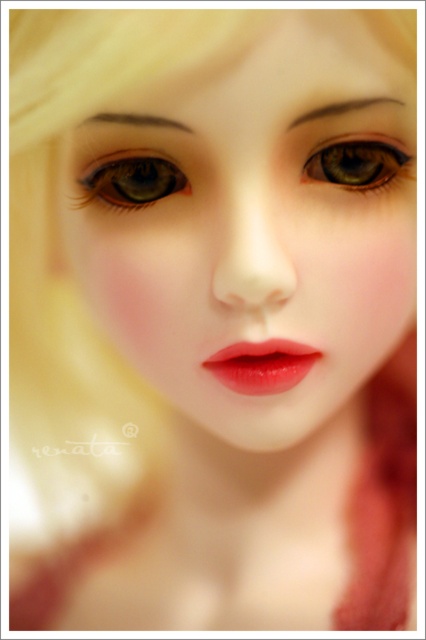
Question: Which point is farther to the camera?

Choices:
 (A) glossy matte lips at center
 (B) matte green eye at center
 (C) brown glossy eye at upper center
 (D) smooth porcelain face at center

Answer: (A)

Question: Which point is farther to the camera?

Choices:
 (A) smooth porcelain face at center
 (B) matte green eye at center
 (C) glossy matte lips at center

Answer: (C)

Question: Can you confirm if matte green eye at center is thinner than brown glossy eye at upper center?

Choices:
 (A) yes
 (B) no

Answer: (B)

Question: Can you confirm if smooth porcelain face at center is thinner than glossy matte lips at center?

Choices:
 (A) no
 (B) yes

Answer: (A)

Question: Can you confirm if smooth porcelain face at center is bigger than brown glossy eye at upper center?

Choices:
 (A) no
 (B) yes

Answer: (B)

Question: Which point is closer to the camera taking this photo?

Choices:
 (A) (230, 371)
 (B) (249, 68)

Answer: (B)